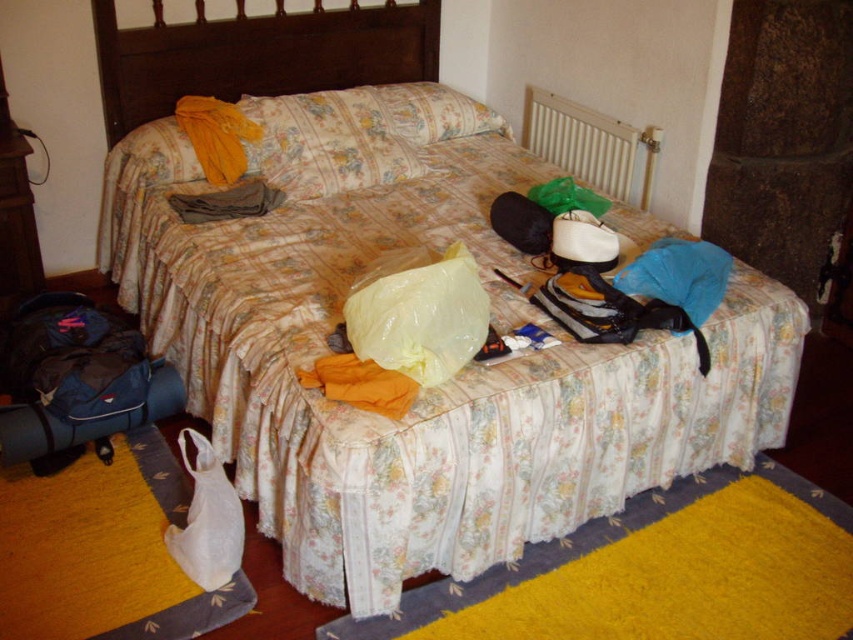
Question: Which point is closer to the camera?

Choices:
 (A) floral fabric pillow at center
 (B) wooden dresser at left
 (C) white plastic bag at lower left
 (D) yellow plastic bag at center

Answer: (D)

Question: Which of the following is the farthest from the observer?

Choices:
 (A) yellow plastic bag at center
 (B) wooden dresser at left

Answer: (B)

Question: From the image, what is the correct spatial relationship of white plastic bag at lower left in relation to wooden dresser at left?

Choices:
 (A) below
 (B) above

Answer: (A)

Question: Does yellow plastic bag at center have a lesser width compared to white plastic bag at lower left?

Choices:
 (A) no
 (B) yes

Answer: (A)

Question: From the image, what is the correct spatial relationship of yellow plastic bag at center in relation to white plastic bag at lower left?

Choices:
 (A) right
 (B) left

Answer: (A)

Question: Among these objects, which one is nearest to the camera?

Choices:
 (A) floral fabric pillow at center
 (B) yellow plastic bag at center

Answer: (B)